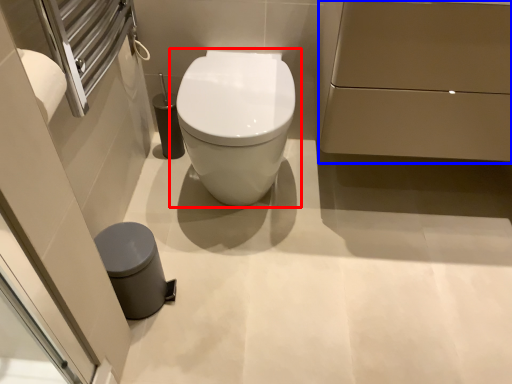
Question: Which point is closer to the camera, toilet (highlighted by a red box) or porcelain (highlighted by a blue box)?

Choices:
 (A) toilet
 (B) porcelain

Answer: (B)